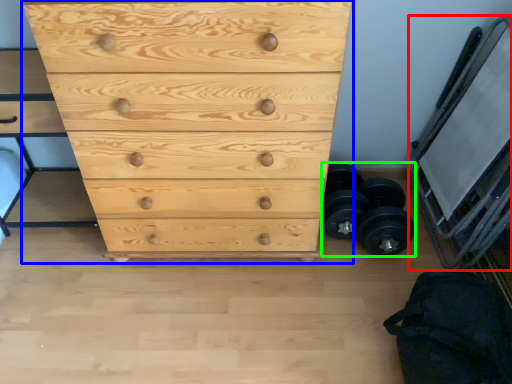
Question: Which object is positioned closest to bunk bed (highlighted by a red box)? Select from chest of drawers (highlighted by a blue box) and dumbbell (highlighted by a green box).

Choices:
 (A) chest of drawers
 (B) dumbbell

Answer: (B)